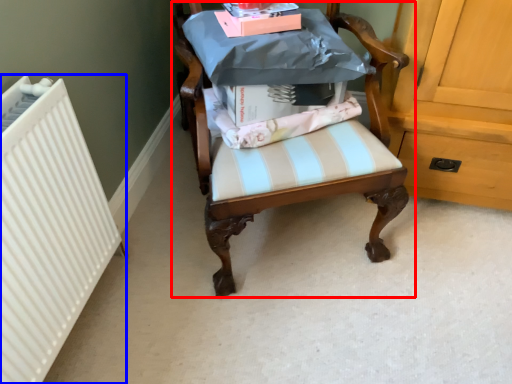
Question: Among these objects, which one is farthest to the camera, chair (highlighted by a red box) or radiator (highlighted by a blue box)?

Choices:
 (A) chair
 (B) radiator

Answer: (B)